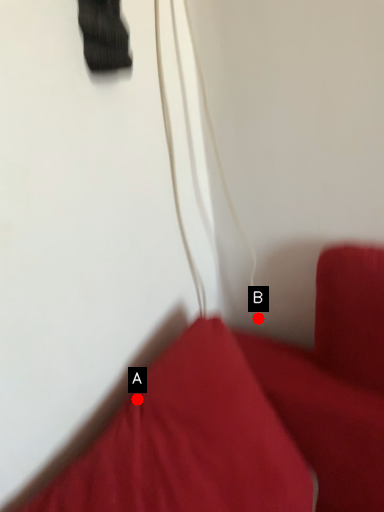
Question: Two points are circled on the image, labeled by A and B beside each circle. Which point is closer to the camera?

Choices:
 (A) A is closer
 (B) B is closer

Answer: (A)